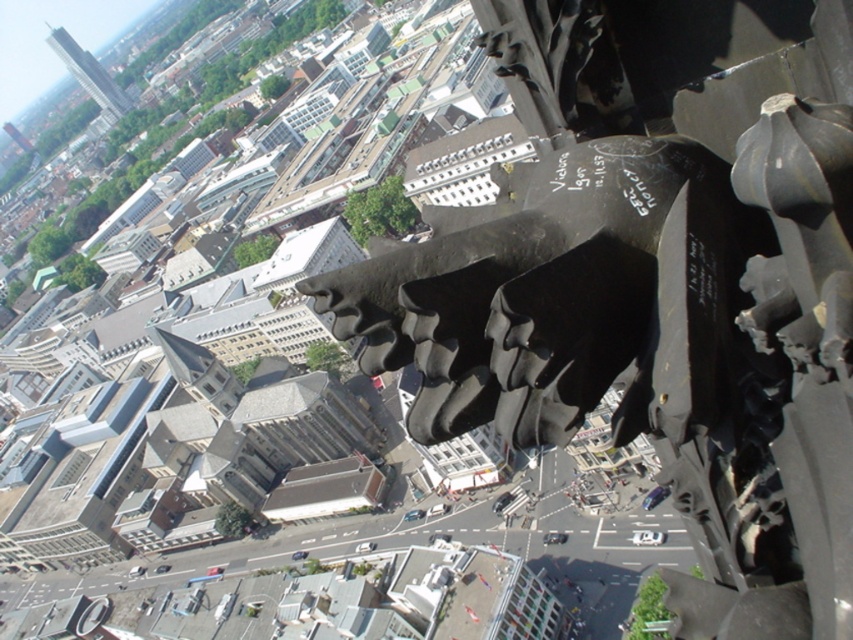
Question: In this image, where is black stone gargoyle at upper center located relative to smooth glass tower at upper left?

Choices:
 (A) left
 (B) right

Answer: (B)

Question: Among these points, which one is nearest to the camera?

Choices:
 (A) (108, 113)
 (B) (749, 374)

Answer: (B)

Question: Which of the following is the closest to the observer?

Choices:
 (A) black stone gargoyle at upper center
 (B) smooth glass tower at upper left

Answer: (A)

Question: Is black stone gargoyle at upper center to the right of smooth glass tower at upper left from the viewer's perspective?

Choices:
 (A) no
 (B) yes

Answer: (B)

Question: Is black stone gargoyle at upper center to the left of smooth glass tower at upper left from the viewer's perspective?

Choices:
 (A) no
 (B) yes

Answer: (A)